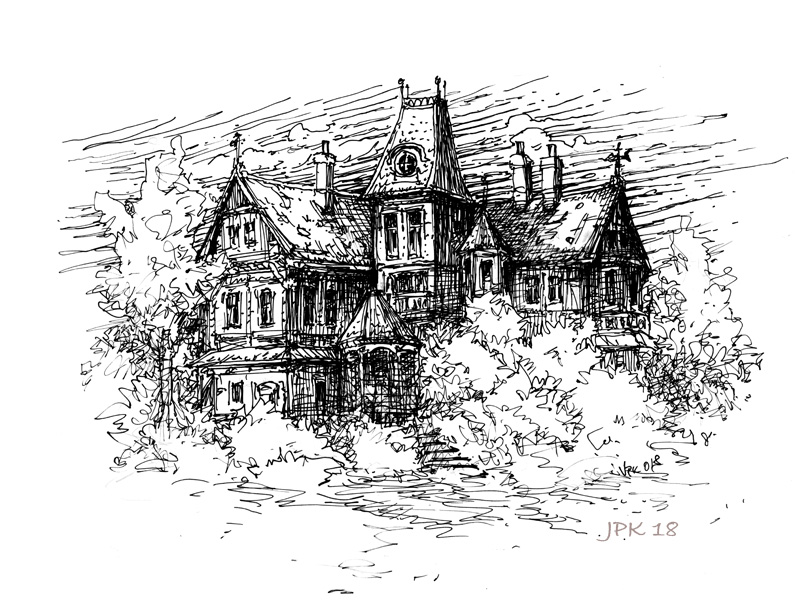
The width and height of the screenshot is (800, 605). What are the coordinates of `windows` in the screenshot? It's located at (229, 309), (262, 316), (246, 242), (230, 238), (390, 240), (417, 236), (478, 276), (529, 283), (545, 283).